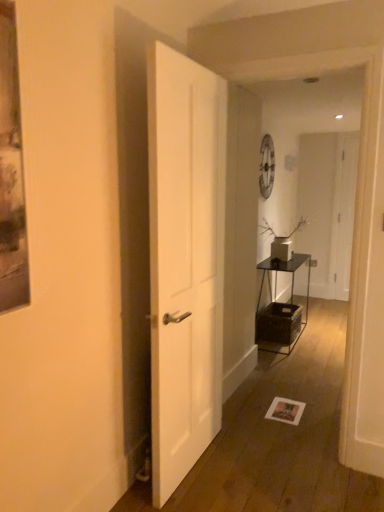
Question: In which direction should I rotate to look at white matte door at center, arranged as the 2th door when viewed from the right?

Choices:
 (A) left
 (B) right

Answer: (B)

Question: Is white matte door at right, marked as the 1th door in a right-to-left arrangement, further to the viewer compared to white matte door at center, arranged as the 2th door when viewed from the right?

Choices:
 (A) yes
 (B) no

Answer: (A)

Question: From the image's perspective, is white matte door at right, which appears as the second door when viewed from the left, located beneath white matte door at center, arranged as the 2th door when viewed from the right?

Choices:
 (A) no
 (B) yes

Answer: (A)

Question: From a real-world perspective, does white matte door at right, marked as the 1th door in a right-to-left arrangement, stand above white matte door at center, marked as the 1th door in a left-to-right arrangement?

Choices:
 (A) no
 (B) yes

Answer: (B)

Question: Can you confirm if white matte door at right, the second door viewed from the front, is smaller than white matte door at center, arranged as the 2th door when viewed from the right?

Choices:
 (A) yes
 (B) no

Answer: (A)

Question: Considering the relative sizes of white matte door at right, which appears as the second door when viewed from the left, and white matte door at center, marked as the 1th door in a left-to-right arrangement, in the image provided, is white matte door at right, which appears as the second door when viewed from the left, wider than white matte door at center, marked as the 1th door in a left-to-right arrangement,?

Choices:
 (A) yes
 (B) no

Answer: (B)

Question: Is white matte door at right, the second door viewed from the front, positioned with its back to white matte door at center, the first door in the front-to-back sequence?

Choices:
 (A) yes
 (B) no

Answer: (B)

Question: Is white matte door at right, which appears as the 1th door when viewed from the back, looking in the opposite direction of metallic black table at center-right?

Choices:
 (A) yes
 (B) no

Answer: (B)

Question: Would you say white matte door at right, which appears as the second door when viewed from the left, contains metallic black table at center-right?

Choices:
 (A) yes
 (B) no

Answer: (B)

Question: From the image's perspective, does white matte door at right, marked as the 1th door in a right-to-left arrangement, appear lower than metallic black table at center-right?

Choices:
 (A) yes
 (B) no

Answer: (B)

Question: Does white matte door at right, which appears as the 1th door when viewed from the back, turn towards metallic black table at center-right?

Choices:
 (A) yes
 (B) no

Answer: (B)

Question: Is white matte door at right, which appears as the second door when viewed from the left, shorter than metallic black table at center-right?

Choices:
 (A) no
 (B) yes

Answer: (A)

Question: Considering the relative positions of white matte door at right, marked as the 1th door in a right-to-left arrangement, and metallic black table at center-right in the image provided, is white matte door at right, marked as the 1th door in a right-to-left arrangement, to the right of metallic black table at center-right from the viewer's perspective?

Choices:
 (A) yes
 (B) no

Answer: (A)

Question: Considering the relative sizes of white matte door at center, arranged as the 2th door when viewed from the right, and white matte door at right, the second door viewed from the front, in the image provided, is white matte door at center, arranged as the 2th door when viewed from the right, bigger than white matte door at right, the second door viewed from the front,?

Choices:
 (A) no
 (B) yes

Answer: (B)